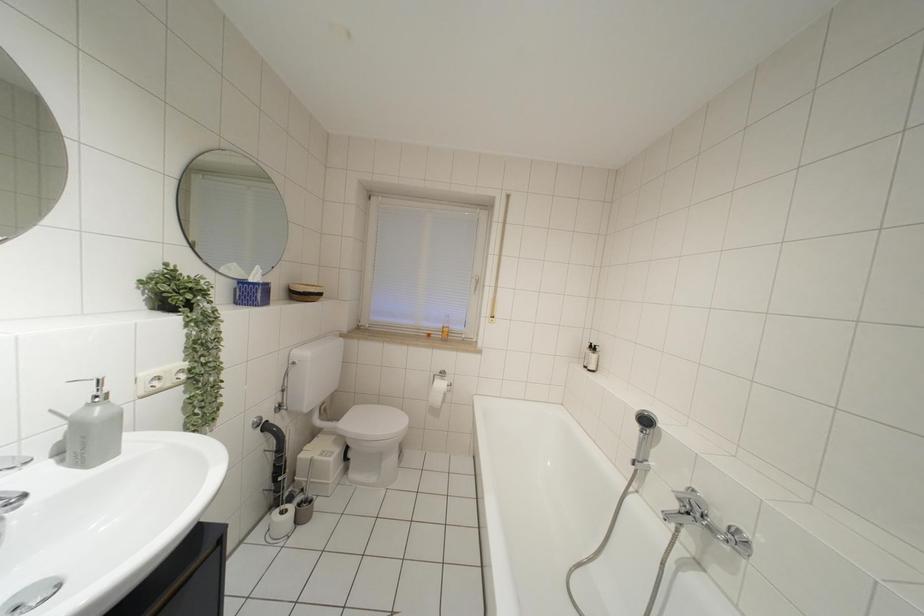
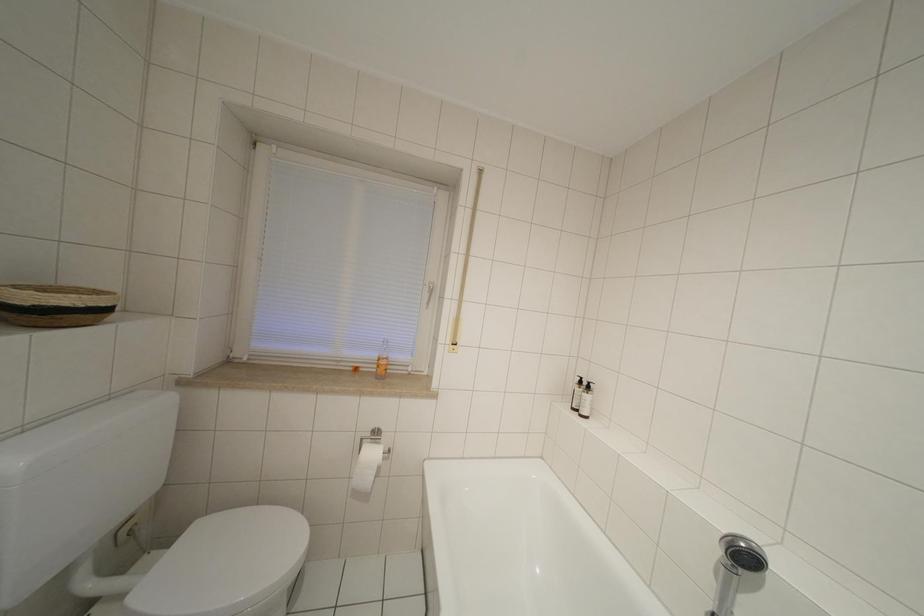
Question: How did the camera likely rotate?

Choices:
 (A) Left
 (B) Right
 (C) Up
 (D) Down

Answer: (B)